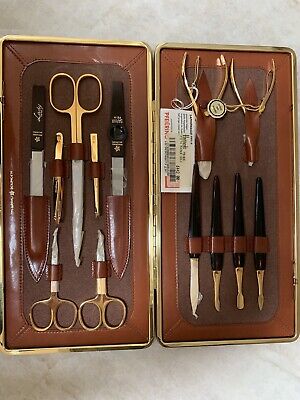
You are a GUI agent. You are given a task and a screenshot of the screen. Output one action in this format:
    pyautogui.click(x=<x>, y=<y>)
    Task: Click on the nail clippers
    The image size is (300, 400).
    Given the screenshot: What is the action you would take?
    pyautogui.click(x=201, y=117), pyautogui.click(x=255, y=114)